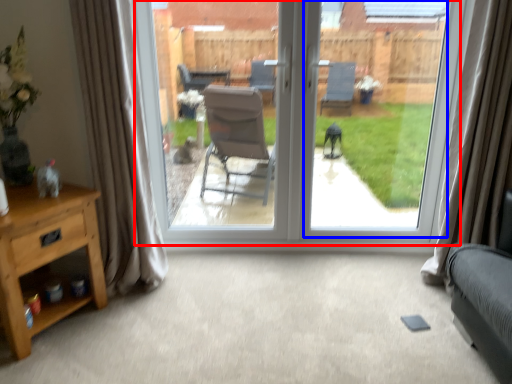
Question: Which point is closer to the camera, window (highlighted by a red box) or window screen (highlighted by a blue box)?

Choices:
 (A) window
 (B) window screen

Answer: (B)